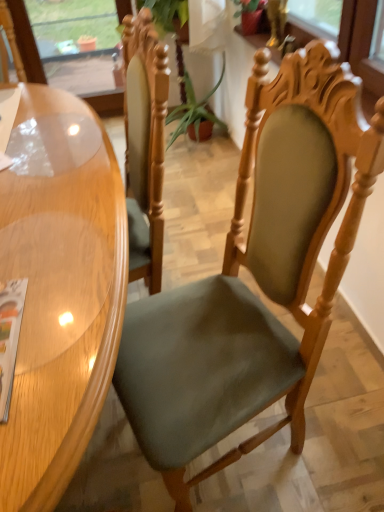
Question: Considering the positions of glossy wood table at left and suede green chair at center in the image, is glossy wood table at left wider or thinner than suede green chair at center?

Choices:
 (A) wide
 (B) thin

Answer: (A)

Question: Based on their positions, is glossy wood table at left located to the left or right of suede green chair at center?

Choices:
 (A) right
 (B) left

Answer: (B)

Question: Considering the real-world distances, which object is closest to the green fabric plant at center?

Choices:
 (A) suede green chair at center
 (B) matte paper magazine at lower left
 (C) transparent glass window screen at upper left
 (D) glossy wood table at left

Answer: (C)

Question: Which of these objects is positioned closest to the green fabric plant at center?

Choices:
 (A) transparent glass window screen at upper left
 (B) glossy wood table at left
 (C) suede green chair at center
 (D) matte paper magazine at lower left

Answer: (A)